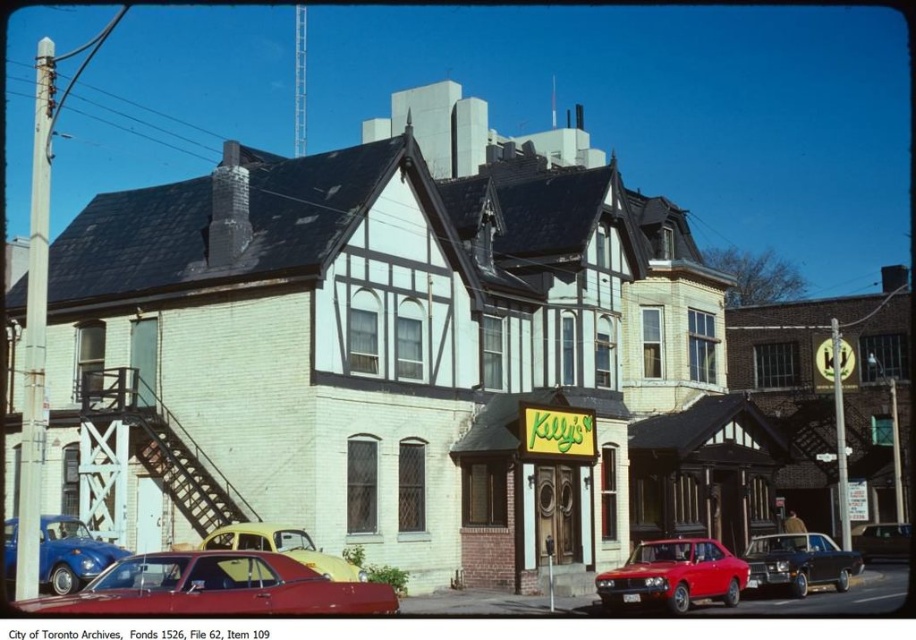
Does yellow signboard at center have a larger size compared to matte red sedan at center?

Correct, yellow signboard at center is larger in size than matte red sedan at center.

Based on the photo, which of these two, yellow signboard at center or matte red sedan at center, stands taller?

yellow signboard at center is taller.

I want to click on yellow signboard at center, so click(541, 486).

Measure the distance from matte red sedan at center to yellow matte car at center.

matte red sedan at center is 47.42 feet from yellow matte car at center.

Who is more forward, (718, 566) or (311, 564)?

Point (311, 564) is more forward.

Is point (611, 580) farther from camera compared to point (238, 536)?

Yes, it is.

Find the location of `matte red sedan at center`. matte red sedan at center is located at coordinates (673, 576).

Which is below, matte red sedan at center or shiny black sedan at center?

shiny black sedan at center is lower down.

Can you confirm if matte red sedan at center is thinner than shiny black sedan at center?

No.

The width and height of the screenshot is (916, 640). What do you see at coordinates (673, 576) in the screenshot? I see `matte red sedan at center` at bounding box center [673, 576].

The image size is (916, 640). I want to click on matte red sedan at center, so click(x=673, y=576).